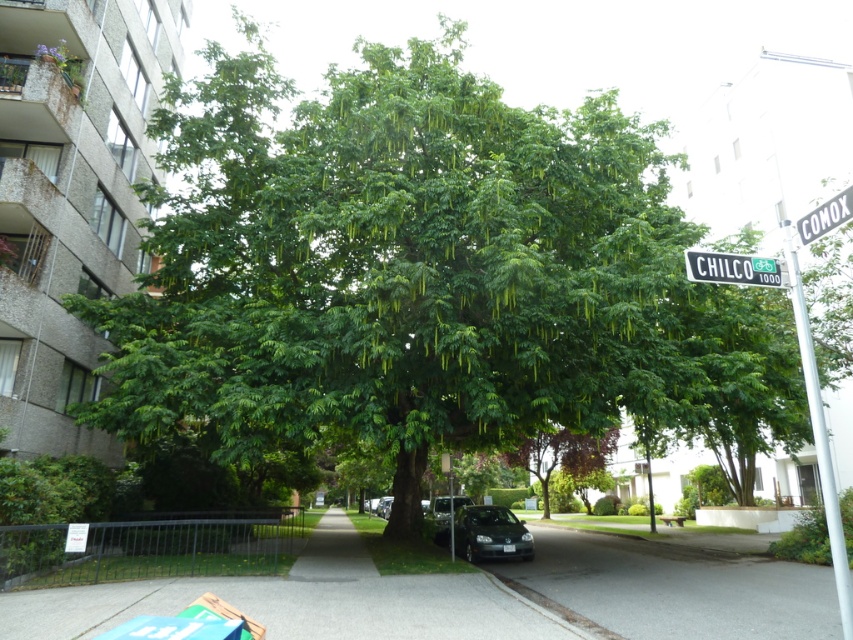
Can you confirm if shiny black car at center is positioned above black plastic street sign at upper center?

Incorrect, shiny black car at center is not positioned above black plastic street sign at upper center.

Can you confirm if shiny black car at center is taller than black plastic street sign at upper center?

Yes, shiny black car at center is taller than black plastic street sign at upper center.

Does point (456, 531) come farther from viewer compared to point (753, 278)?

Yes, point (456, 531) is farther from viewer.

Identify the location of shiny black car at center. The image size is (853, 640). (486, 532).

Is silver metallic pole at upper right above purple-leaved tree at center?

Yes, silver metallic pole at upper right is above purple-leaved tree at center.

Between silver metallic pole at upper right and purple-leaved tree at center, which one is positioned higher?

Positioned higher is silver metallic pole at upper right.

Image resolution: width=853 pixels, height=640 pixels. What do you see at coordinates (819, 436) in the screenshot?
I see `silver metallic pole at upper right` at bounding box center [819, 436].

Identify the location of silver metallic pole at upper right. (819, 436).

Does shiny black car at center have a larger size compared to white plastic street sign at upper right?

Yes.

Image resolution: width=853 pixels, height=640 pixels. What do you see at coordinates (486, 532) in the screenshot?
I see `shiny black car at center` at bounding box center [486, 532].

Identify the location of shiny black car at center. (486, 532).